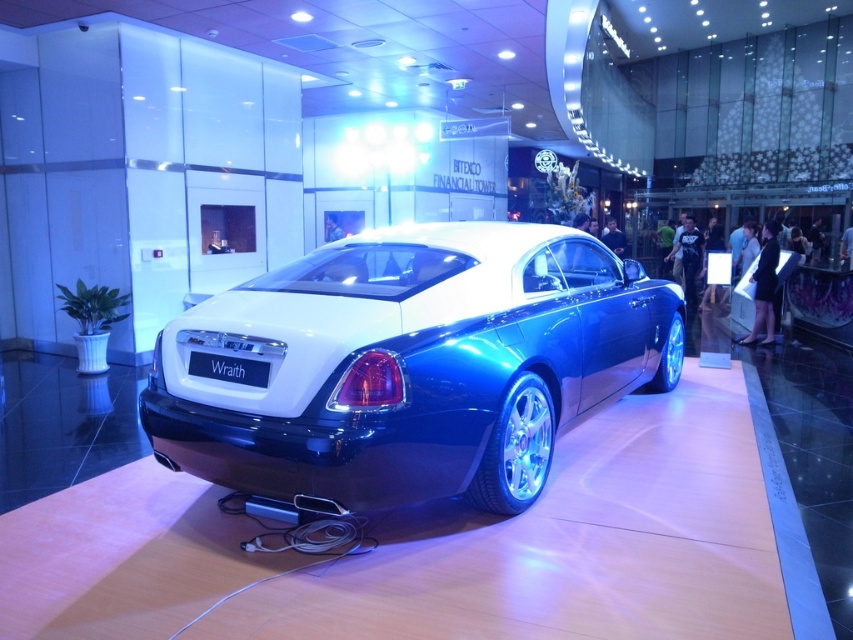
Does metallic blue car at center appear on the left side of black matte license plate at rear?

Incorrect, metallic blue car at center is not on the left side of black matte license plate at rear.

Is point (306, 452) positioned after point (225, 372)?

No, (306, 452) is in front of (225, 372).

What do you see at coordinates (410, 364) in the screenshot?
I see `metallic blue car at center` at bounding box center [410, 364].

Find the location of a particular element. This screenshot has height=640, width=853. metallic blue car at center is located at coordinates (410, 364).